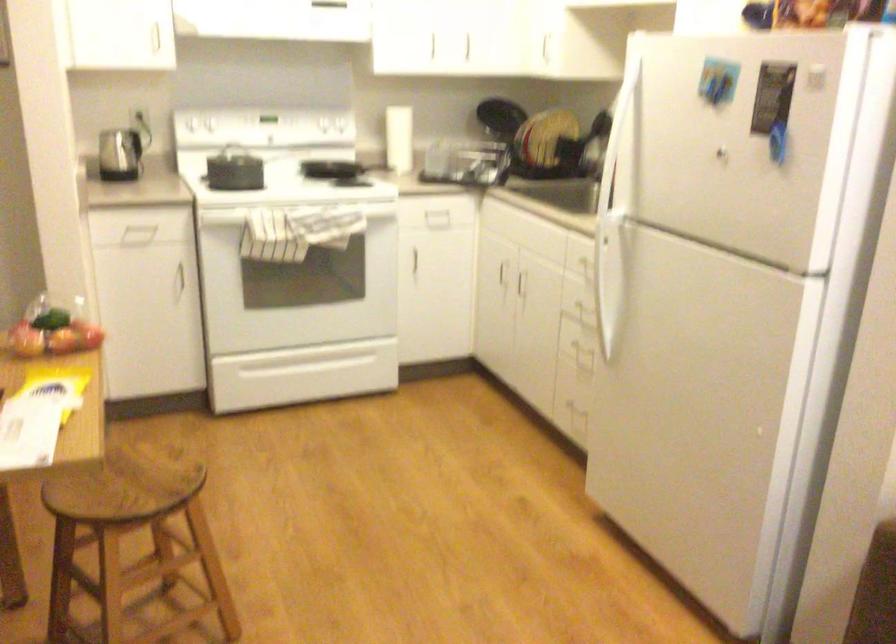
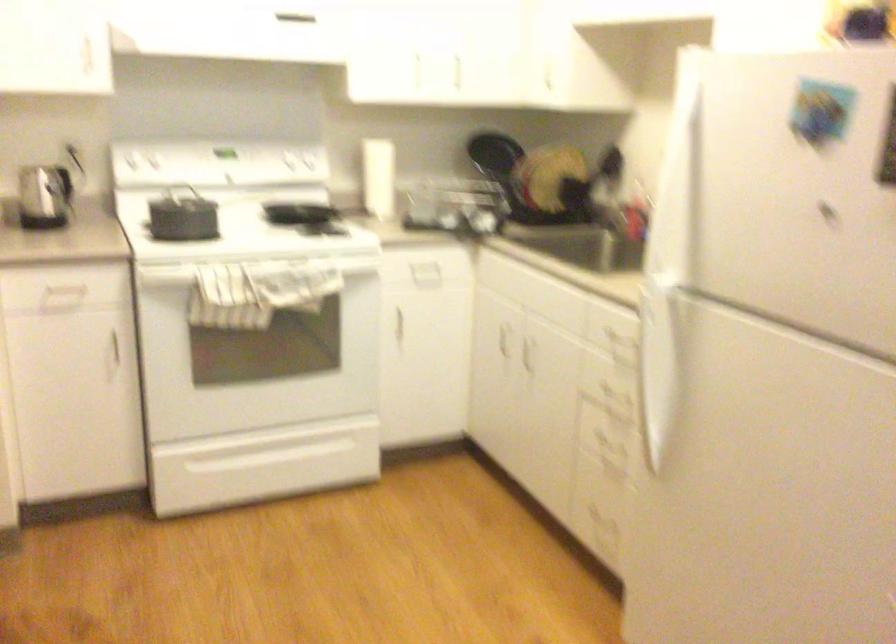
Where in the second image is the point corresponding to point (398, 131) from the first image?

(377, 178)